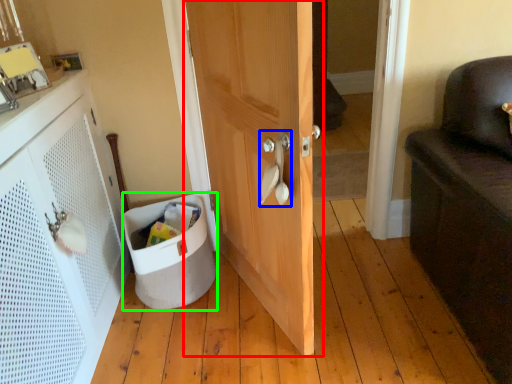
Question: Which object is the closest to the door (highlighted by a red box)? Choose among these: door handle (highlighted by a blue box) or laundry basket (highlighted by a green box).

Choices:
 (A) door handle
 (B) laundry basket

Answer: (A)